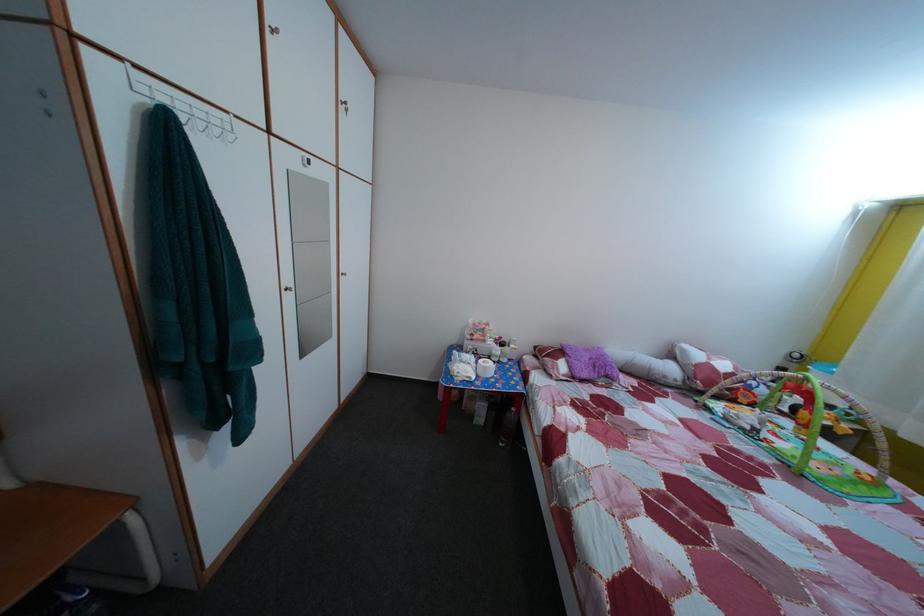
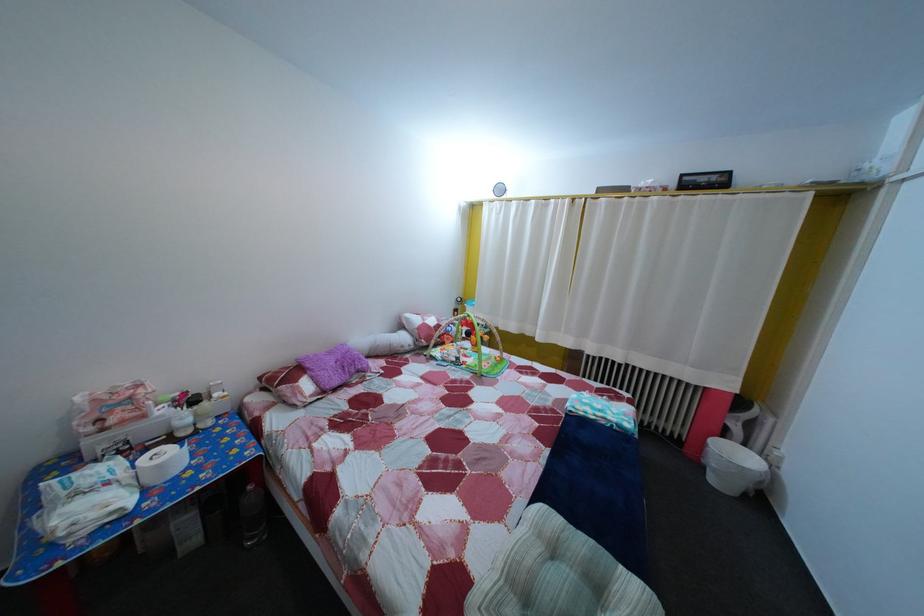
Question: The camera is either moving clockwise (left) or counter-clockwise (right) around the object. The first image is from the beginning of the video and the second image is from the end. Is the camera moving left or right when shooting the video?

Choices:
 (A) Left
 (B) Right

Answer: (A)